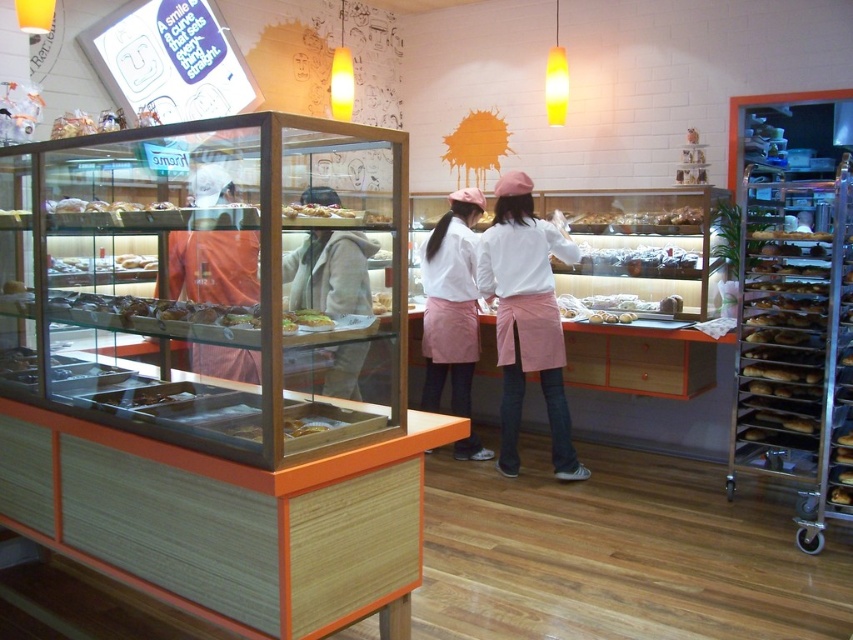
You are a customer in this bakery and want to touch both the white cotton shirt at center and the orange fabric at center. What is the minimum distance you need to walk to reach both items?

The minimum distance you need to walk to reach both items is 1.62 meters, as the white cotton shirt at center and orange fabric at center are 1.62 meters apart.

You are a customer in the bakery and you see both the white cotton shirt at center and the orange fabric at center. Which one is closer to you?

The white cotton shirt at center is closer to you because the orange fabric at center is behind it.

You are a customer standing at the entrance of the bakery. You want to take a photo of the orange fabric at center with your phone. Your phone has a maximum zoom range of 2 meters. Can you take a clear photo without moving closer?

The orange fabric at center is 2.86 meters away from the camera. Since the phone can only zoom up to 2 meters, you cannot take a clear photo without moving closer.